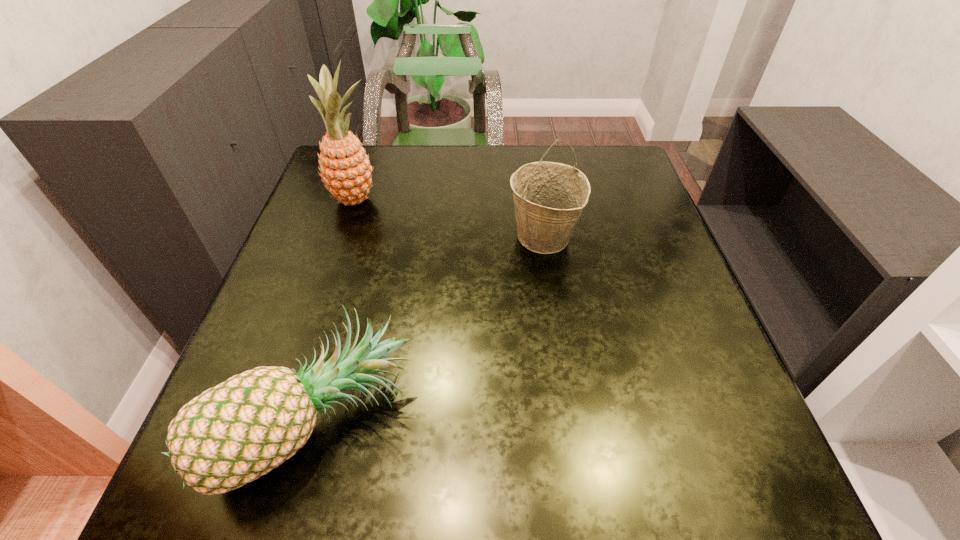
Where is `empty space that is in between the second shortest object and the farther pineapple`? The image size is (960, 540). empty space that is in between the second shortest object and the farther pineapple is located at coordinates (449, 218).

Find the location of a particular element. This screenshot has height=540, width=960. vacant space that is in between the second shortest object and the shorter pineapple is located at coordinates (429, 329).

At what (x,y) coordinates should I click in order to perform the action: click on empty space between the taller pineapple and the shorter pineapple. Please return your answer as a coordinate pair (x, y). The height and width of the screenshot is (540, 960). Looking at the image, I should click on (335, 310).

At what (x,y) coordinates should I click in order to perform the action: click on free space that is in between the rightmost object and the nearer pineapple. Please return your answer as a coordinate pair (x, y). Image resolution: width=960 pixels, height=540 pixels. Looking at the image, I should click on (429, 329).

You are a GUI agent. You are given a task and a screenshot of the screen. Output one action in this format:
    pyautogui.click(x=<x>, y=<y>)
    Task: Click on the empty space that is in between the second tallest object and the farther pineapple
    The height and width of the screenshot is (540, 960).
    Given the screenshot: What is the action you would take?
    pyautogui.click(x=449, y=218)

At what (x,y) coordinates should I click in order to perform the action: click on free space between the shortest object and the taller pineapple. Please return your answer as a coordinate pair (x, y). Image resolution: width=960 pixels, height=540 pixels. Looking at the image, I should click on (335, 310).

I want to click on vacant space that's between the nearer pineapple and the tallest object, so click(x=335, y=310).

Identify the location of empty location between the shorter pineapple and the tallest object. This screenshot has width=960, height=540. 335,310.

At what (x,y) coordinates should I click in order to perform the action: click on free space between the wine bucket and the shorter pineapple. Please return your answer as a coordinate pair (x, y). Looking at the image, I should click on (429, 329).

Identify which object is the nearest to the taller pineapple. Please provide its 2D coordinates. Your answer should be formatted as a tuple, i.e. [(x, y)], where the tuple contains the x and y coordinates of a point satisfying the conditions above.

[(549, 197)]